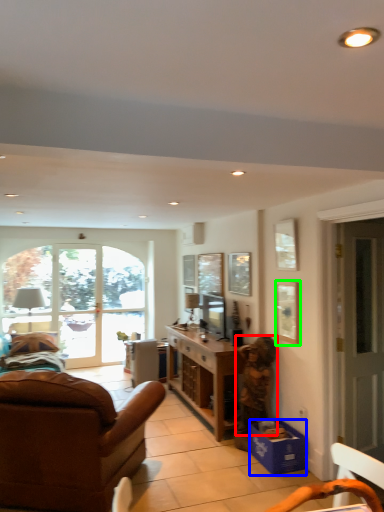
Question: Based on their relative distances, which object is nearer to person (highlighted by a red box)? Choose from box (highlighted by a blue box) and picture frame (highlighted by a green box).

Choices:
 (A) box
 (B) picture frame

Answer: (A)